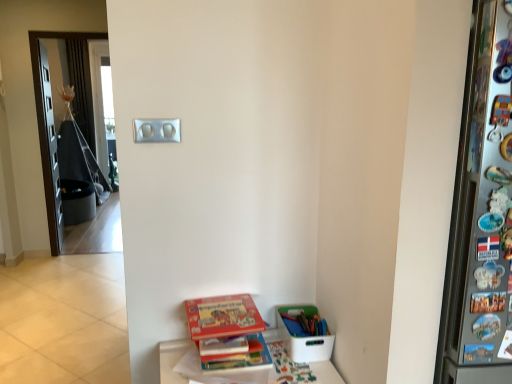
Identify the location of vacant region above stacked books at lower right (from a real-world perspective). The height and width of the screenshot is (384, 512). (248, 362).